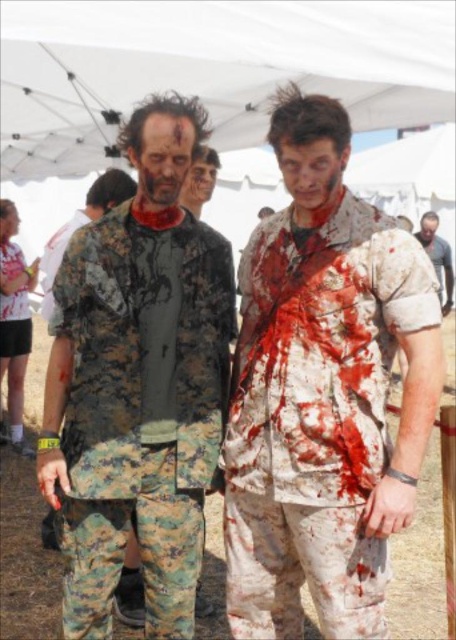
The image size is (456, 640). Describe the element at coordinates (139, 384) in the screenshot. I see `camouflage fabric shirt at left` at that location.

How far apart are camouflage fabric shirt at left and camouflage pants at center?

A distance of 5.07 meters exists between camouflage fabric shirt at left and camouflage pants at center.

Image resolution: width=456 pixels, height=640 pixels. In order to click on camouflage fabric shirt at left in this screenshot , I will do `click(139, 384)`.

Can you confirm if blood-stained fabric shirt at center is positioned above camouflage fabric shirt at center?

No, blood-stained fabric shirt at center is not above camouflage fabric shirt at center.

Can you confirm if blood-stained fabric shirt at center is thinner than camouflage fabric shirt at center?

No.

Is point (394, 225) positioned behind point (201, 186)?

No, it is not.

Where is `blood-stained fabric shirt at center`? The width and height of the screenshot is (456, 640). blood-stained fabric shirt at center is located at coordinates (322, 392).

Is point (373, 397) positioned after point (424, 244)?

No, it is in front of (424, 244).

Is blood-stained fabric shirt at center to the left of camouflage pants at center from the viewer's perspective?

Yes, blood-stained fabric shirt at center is to the left of camouflage pants at center.

Who is more distant from viewer, [353,285] or [421,240]?

The point [421,240] is behind.

The width and height of the screenshot is (456, 640). Find the location of `blood-stained fabric shirt at center`. blood-stained fabric shirt at center is located at coordinates point(322,392).